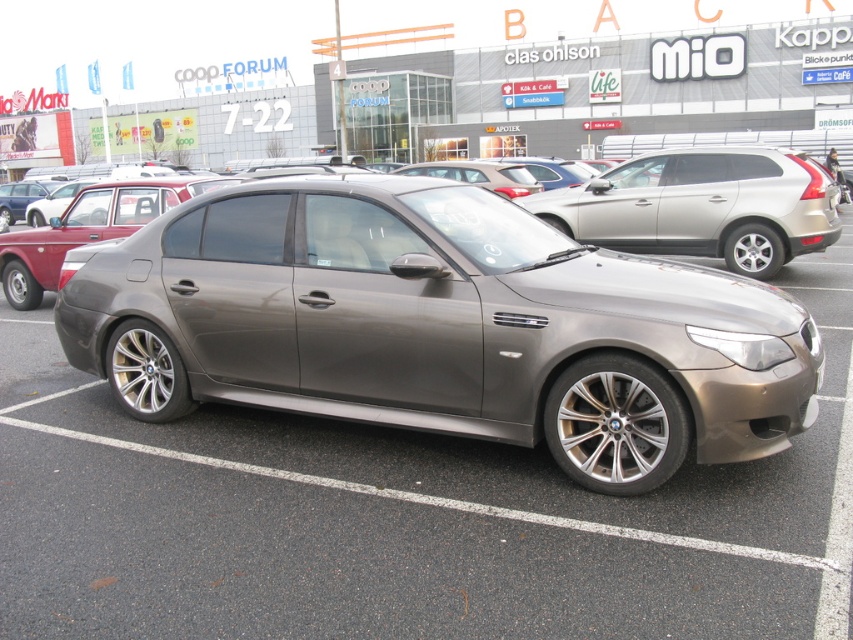
Who is higher up, satin silver car at center or satin metallic car at center?

Positioned higher is satin metallic car at center.

Is point (694, 202) positioned after point (422, 164)?

That is False.

At what (x,y) coordinates should I click in order to perform the action: click on satin silver car at center. Please return your answer as a coordinate pair (x, y). This screenshot has width=853, height=640. Looking at the image, I should click on (701, 205).

Based on the photo, does metallic gray car at center have a lesser height compared to satin metallic car at center?

Incorrect, metallic gray car at center's height does not fall short of satin metallic car at center's.

Which is in front, point (140, 570) or point (422, 170)?

Point (140, 570) is in front.

Between point (737, 483) and point (467, 161), which one is positioned in front?

Point (737, 483)

I want to click on metallic gray car at center, so click(x=408, y=428).

Is point (79, 529) less distant than point (721, 164)?

Yes, it is in front of point (721, 164).

Who is shorter, metallic gray car at center or satin silver car at center?

satin silver car at center

The width and height of the screenshot is (853, 640). In order to click on metallic gray car at center in this screenshot , I will do `click(408, 428)`.